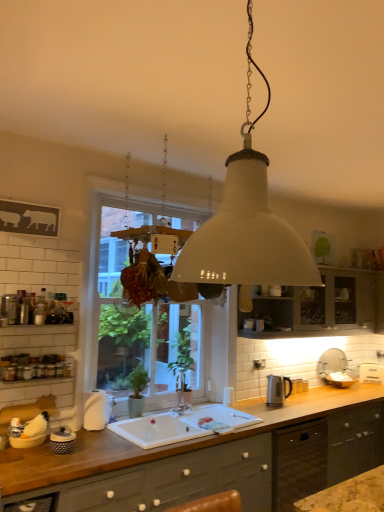
In order to face white glass window at center, should I rotate leftwards or rightwards?

To face it directly, rotate left by 3.970 degrees.

The image size is (384, 512). What do you see at coordinates (139, 322) in the screenshot?
I see `white glass window at center` at bounding box center [139, 322].

Find the location of a particular element. matte gray cabinets at lower center, which is the 2th cabinetry from right to left is located at coordinates (175, 480).

Measure the distance between point (238, 468) and camera.

The distance of point (238, 468) from camera is 9.31 feet.

Locate an element on the screen. Image resolution: width=384 pixels, height=512 pixels. white ceramic sink at center is located at coordinates (180, 425).

Is polished stainless steel kettle at right, arranged as the 1th appliance when viewed from the back, to the left or to the right of white glass window at center in the image?

polished stainless steel kettle at right, arranged as the 1th appliance when viewed from the back, is to the right of white glass window at center.

Is polished stainless steel kettle at right, placed as the 2th appliance when sorted from left to right, next to white glass window at center?

No, polished stainless steel kettle at right, placed as the 2th appliance when sorted from left to right, is not next to white glass window at center.

Is polished stainless steel kettle at right, arranged as the 1th appliance when viewed from the back, shorter than white glass window at center?

Correct, polished stainless steel kettle at right, arranged as the 1th appliance when viewed from the back, is not as tall as white glass window at center.

How far apart are polished stainless steel kettle at right, arranged as the 1th appliance when viewed from the back, and white glass window at center?

They are 1.26 meters apart.

In the image, there is a matte black container at lower left, which is the second appliance in back-to-front order. In order to click on window above it (from the image's perspective) in this screenshot , I will do `click(139, 322)`.

From a real-world perspective, is white glass window at center under matte black container at lower left, the 2th appliance from the right?

No, from a real-world perspective, white glass window at center is not under matte black container at lower left, the 2th appliance from the right.

Is white glass window at center facing towards matte black container at lower left, arranged as the first appliance when viewed from the front?

No, white glass window at center is not aimed at matte black container at lower left, arranged as the first appliance when viewed from the front.

From the picture: Does white glass window at center have a greater height compared to matte black container at lower left, which is the first appliance from left to right?

Indeed, white glass window at center has a greater height compared to matte black container at lower left, which is the first appliance from left to right.

Is matte gray cabinets at lower center, the second cabinetry from the back, positioned in front of white matte lampshade at center?

No.

From a real-world perspective, is matte gray cabinets at lower center, the second cabinetry from the back, positioned above or below white matte lampshade at center?

matte gray cabinets at lower center, the second cabinetry from the back, is situated lower than white matte lampshade at center in the real world.

Considering the sizes of objects matte gray cabinets at lower center, the second cabinetry from the back, and white matte lampshade at center in the image provided, who is thinner, matte gray cabinets at lower center, the second cabinetry from the back, or white matte lampshade at center?

Thinner between the two is white matte lampshade at center.

From a real-world perspective, is matte gray cabinet at center, positioned as the 1th cabinetry in back-to-front order, positioned under white glass window at center based on gravity?

Actually, matte gray cabinet at center, positioned as the 1th cabinetry in back-to-front order, is physically above white glass window at center in the real world.

Between point (345, 301) and point (101, 348), which one is positioned behind?

Positioned behind is point (345, 301).

Measure the distance from matte gray cabinet at center, positioned as the 1th cabinetry in back-to-front order, to white glass window at center.

The distance of matte gray cabinet at center, positioned as the 1th cabinetry in back-to-front order, from white glass window at center is 1.15 meters.

Is matte gray cabinet at center, positioned as the 2th cabinetry in left-to-right order, at the right side of white glass window at center?

Correct, you'll find matte gray cabinet at center, positioned as the 2th cabinetry in left-to-right order, to the right of white glass window at center.

From the image's perspective, which is above, polished stainless steel kettle at right, which is the first appliance in right-to-left order, or white matte lampshade at center?

white matte lampshade at center appears higher in the image.

From a real-world perspective, which is physically below, polished stainless steel kettle at right, which is the first appliance in right-to-left order, or white matte lampshade at center?

polished stainless steel kettle at right, which is the first appliance in right-to-left order.

Does polished stainless steel kettle at right, positioned as the second appliance in front-to-back order, contain white matte lampshade at center?

No, white matte lampshade at center is not a part of polished stainless steel kettle at right, positioned as the second appliance in front-to-back order.

How many degrees apart are the facing directions of polished stainless steel kettle at right, placed as the 2th appliance when sorted from left to right, and white matte lampshade at center?

The facing directions of polished stainless steel kettle at right, placed as the 2th appliance when sorted from left to right, and white matte lampshade at center are 96 degrees apart.

In the scene shown: From a real-world perspective, is matte black container at lower left, arranged as the first appliance when viewed from the front, located beneath matte gray cabinet at center, the 1th cabinetry viewed from the right?

Yes.

Is matte black container at lower left, which is the first appliance from left to right, closer to camera compared to matte gray cabinet at center, the 2th cabinetry when ordered from bottom to top?

Yes, it is.

Does matte black container at lower left, arranged as the first appliance when viewed from the front, have a greater height compared to matte gray cabinet at center, positioned as the 1th cabinetry in back-to-front order?

In fact, matte black container at lower left, arranged as the first appliance when viewed from the front, may be shorter than matte gray cabinet at center, positioned as the 1th cabinetry in back-to-front order.

Locate an element on the screen. cabinetry behind the matte black container at lower left, which is the second appliance in back-to-front order is located at coordinates (323, 305).

From a real-world perspective, between matte gray cabinets at lower center, the second cabinetry from the back, and polished stainless steel kettle at right, positioned as the second appliance in front-to-back order, who is vertically higher?

From a 3D spatial view, polished stainless steel kettle at right, positioned as the second appliance in front-to-back order, is above.

Consider the image. Is matte gray cabinets at lower center, the 1th cabinetry positioned from the left, located outside polished stainless steel kettle at right, placed as the 2th appliance when sorted from left to right?

matte gray cabinets at lower center, the 1th cabinetry positioned from the left, is positioned outside polished stainless steel kettle at right, placed as the 2th appliance when sorted from left to right.

The width and height of the screenshot is (384, 512). I want to click on appliance that is the 1st object located above the matte gray cabinets at lower center, the second cabinetry from the back (from the image's perspective), so click(x=278, y=390).

Can you confirm if matte gray cabinets at lower center, placed as the 2th cabinetry when sorted from top to bottom, is wider than polished stainless steel kettle at right, placed as the 2th appliance when sorted from left to right?

Answer: Indeed, matte gray cabinets at lower center, placed as the 2th cabinetry when sorted from top to bottom, has a greater width compared to polished stainless steel kettle at right, placed as the 2th appliance when sorted from left to right.

This screenshot has width=384, height=512. Find the location of `window that appears above the polished stainless steel kettle at right, placed as the 2th appliance when sorted from left to right (from a real-world perspective)`. window that appears above the polished stainless steel kettle at right, placed as the 2th appliance when sorted from left to right (from a real-world perspective) is located at coordinates (139, 322).

At what (x,y) coordinates should I click in order to perform the action: click on the 2nd appliance located beneath the white glass window at center (from a real-world perspective). Please return your answer as a coordinate pair (x, y). The height and width of the screenshot is (512, 384). Looking at the image, I should click on coord(62,441).

When comparing their distances from white glass window at center, does white ceramic sink at center or matte black container at lower left, which is the second appliance in back-to-front order, seem closer?

white ceramic sink at center.

Looking at the image, which one is located further to polished stainless steel kettle at right, placed as the 2th appliance when sorted from left to right, white glass window at center or matte black container at lower left, which is the first appliance from left to right?

The object further to polished stainless steel kettle at right, placed as the 2th appliance when sorted from left to right, is matte black container at lower left, which is the first appliance from left to right.

Consider the image. Estimate the real-world distances between objects in this image. Which object is closer to white glass window at center, matte gray cabinet at center, the second cabinetry when ordered from front to back, or matte gray cabinets at lower center, the 1th cabinetry positioned from the left?

matte gray cabinet at center, the second cabinetry when ordered from front to back, is positioned closer to the anchor white glass window at center.

Looking at this image, considering their positions, is matte gray cabinet at center, which appears as the first cabinetry when viewed from the top, positioned closer to polished stainless steel kettle at right, which is the first appliance in right-to-left order, than white ceramic sink at center?

white ceramic sink at center is positioned closer to the anchor polished stainless steel kettle at right, which is the first appliance in right-to-left order.

Estimate the real-world distances between objects in this image. Which object is closer to polished stainless steel kettle at right, which is the first appliance in right-to-left order, white matte lampshade at center or white ceramic sink at center?

Based on the image, white ceramic sink at center appears to be nearer to polished stainless steel kettle at right, which is the first appliance in right-to-left order.

Which object lies nearer to the anchor point matte black container at lower left, arranged as the first appliance when viewed from the front, white ceramic sink at center or white glass window at center?

white ceramic sink at center is closer to matte black container at lower left, arranged as the first appliance when viewed from the front.

Which object lies nearer to the anchor point white matte lampshade at center, white ceramic sink at center or white glass window at center?

Among the two, white ceramic sink at center is located nearer to white matte lampshade at center.

When comparing their distances from matte black container at lower left, which is the second appliance in back-to-front order, does matte gray cabinet at center, the 1th cabinetry viewed from the right, or white ceramic sink at center seem closer?

white ceramic sink at center is positioned closer to the anchor matte black container at lower left, which is the second appliance in back-to-front order.

Where is `window between matte gray cabinets at lower center, placed as the 2th cabinetry when sorted from top to bottom, and polished stainless steel kettle at right, arranged as the 1th appliance when viewed from the back, in the front-back direction`? window between matte gray cabinets at lower center, placed as the 2th cabinetry when sorted from top to bottom, and polished stainless steel kettle at right, arranged as the 1th appliance when viewed from the back, in the front-back direction is located at coordinates (139, 322).

The height and width of the screenshot is (512, 384). Find the location of `sink between white matte lampshade at center and polished stainless steel kettle at right, which is the first appliance in right-to-left order, in the front-back direction`. sink between white matte lampshade at center and polished stainless steel kettle at right, which is the first appliance in right-to-left order, in the front-back direction is located at coordinates (180, 425).

Identify the location of cabinetry between white matte lampshade at center and white glass window at center along the z-axis. Image resolution: width=384 pixels, height=512 pixels. (175, 480).

The image size is (384, 512). I want to click on appliance positioned between white matte lampshade at center and matte gray cabinet at center, the 1th cabinetry viewed from the right, from near to far, so click(62, 441).